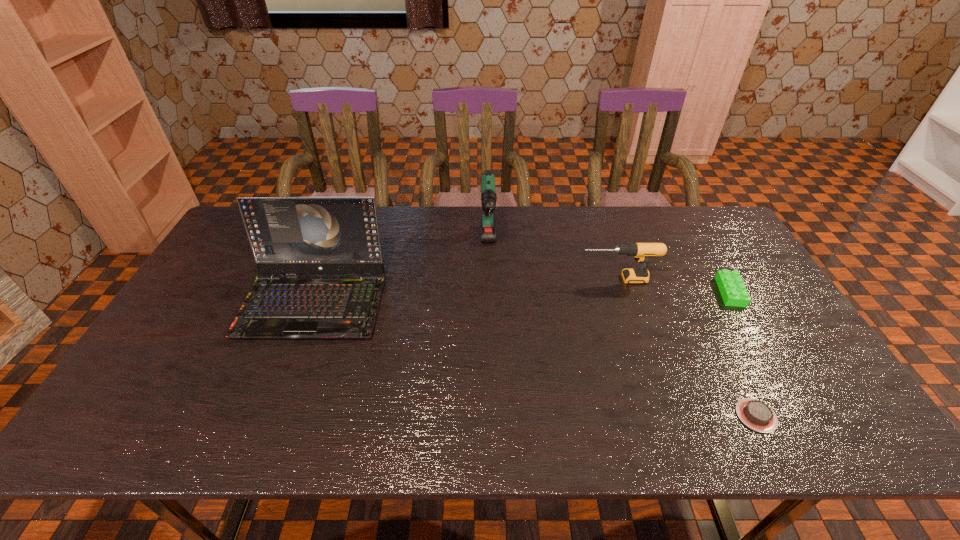
Locate an element on the screen. This screenshot has height=540, width=960. free space between the Lego and the taller drill is located at coordinates (610, 269).

This screenshot has height=540, width=960. What are the coordinates of `empty space between the fourth object from right to left and the second object from right to left` in the screenshot? It's located at (622, 331).

Identify the location of blank region between the laptop computer and the rightmost object. The width and height of the screenshot is (960, 540). (522, 297).

Locate which object ranks in proximity to the nearest object. Please provide its 2D coordinates. Your answer should be formatted as a tuple, i.e. [(x, y)], where the tuple contains the x and y coordinates of a point satisfying the conditions above.

[(733, 291)]

Locate which object ranks second in proximity to the third shortest object. Please provide its 2D coordinates. Your answer should be formatted as a tuple, i.e. [(x, y)], where the tuple contains the x and y coordinates of a point satisfying the conditions above.

[(488, 197)]

The height and width of the screenshot is (540, 960). Find the location of `vacant space that satisfies the following two spatial constraints: 1. on the handle side of the nearer drill; 2. on the back side of the Lego`. vacant space that satisfies the following two spatial constraints: 1. on the handle side of the nearer drill; 2. on the back side of the Lego is located at coordinates (622, 292).

The height and width of the screenshot is (540, 960). Identify the location of vacant space that satisfies the following two spatial constraints: 1. on the handle side of the nearer drill; 2. on the back side of the nearest object. (663, 415).

Locate an element on the screen. The image size is (960, 540). free space in the image that satisfies the following two spatial constraints: 1. on the handle side of the fourth tallest object; 2. on the right side of the right drill is located at coordinates (622, 292).

At what (x,y) coordinates should I click in order to perform the action: click on vacant space that satisfies the following two spatial constraints: 1. on the handle side of the nearer drill; 2. on the screen of the laptop computer. Please return your answer as a coordinate pair (x, y). Looking at the image, I should click on pyautogui.click(x=625, y=301).

Identify the location of vacant point that satisfies the following two spatial constraints: 1. on the handle side of the right drill; 2. on the back side of the nearest object. (663, 415).